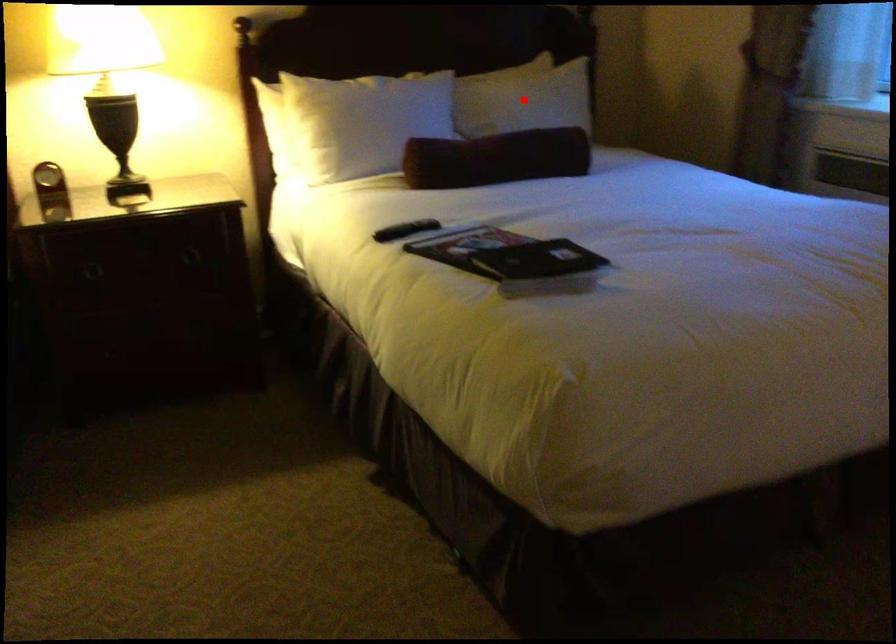
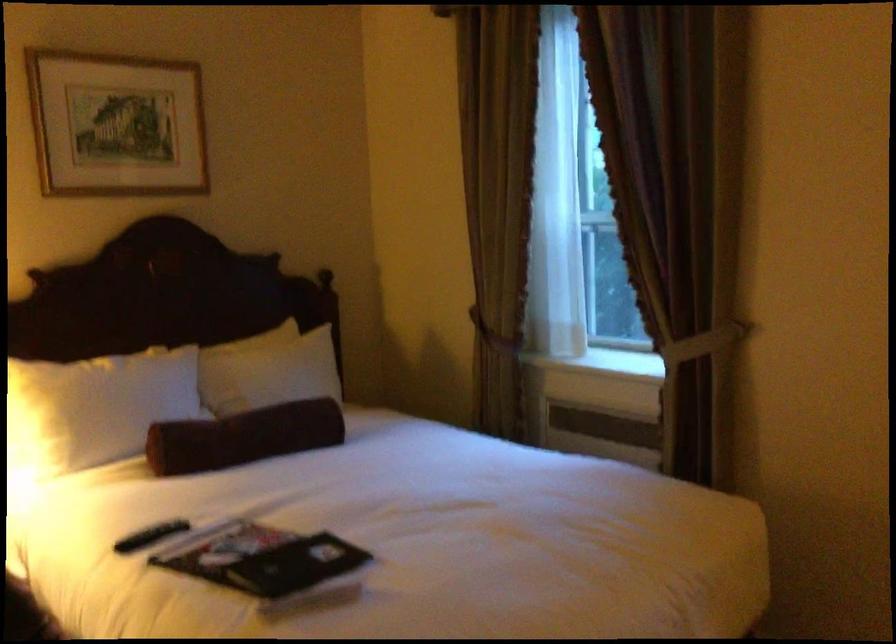
The point at the highlighted location is marked in the first image. Where is the corresponding point in the second image?

(274, 371)